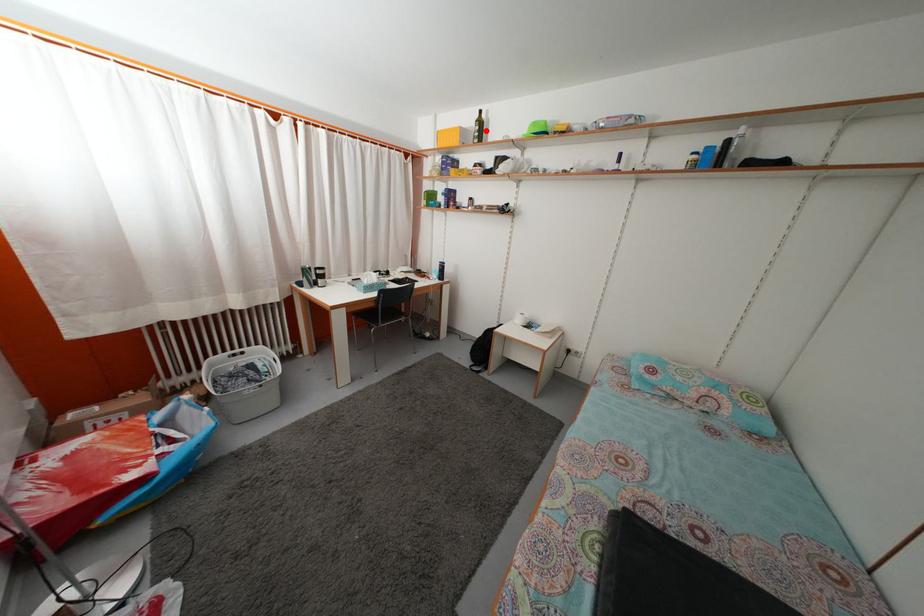
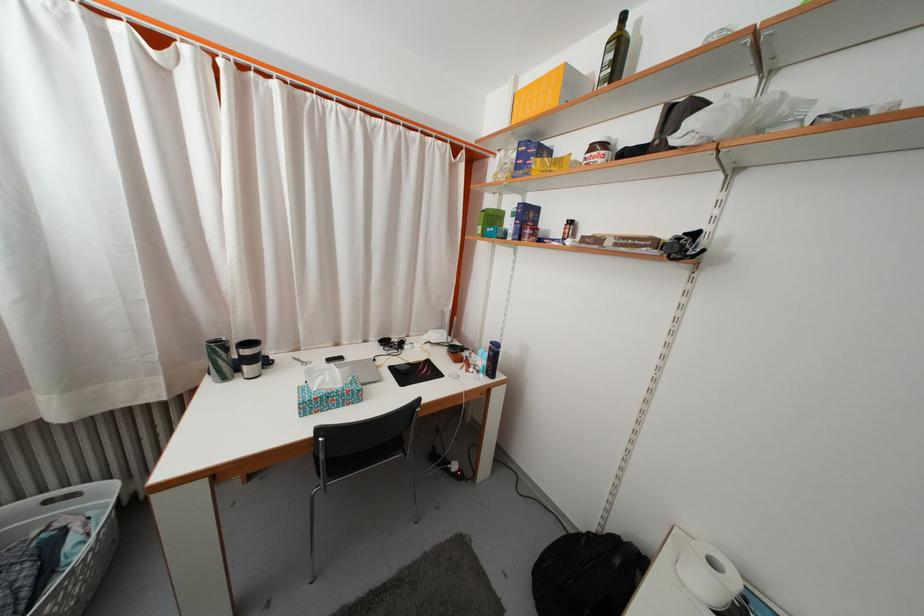
Question: I am providing you with two images of the same scene from different viewpoints. Image1 has a red point marked. In image2, the corresponding 3D location appears at what relative position? Reply with the corresponding letter.

Choices:
 (A) Closer
 (B) Farther

Answer: (B)